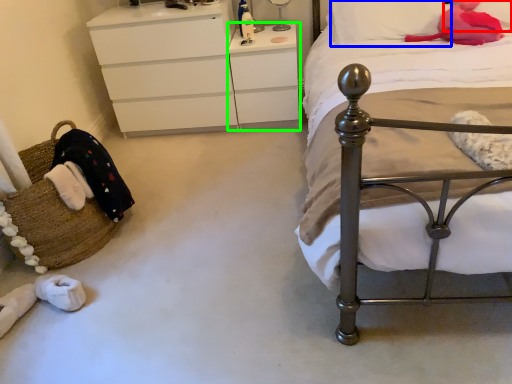
Question: Estimate the real-world distances between objects in this image. Which object is closer to pillow (highlighted by a red box), pillow (highlighted by a blue box) or changing table (highlighted by a green box)?

Choices:
 (A) pillow
 (B) changing table

Answer: (A)